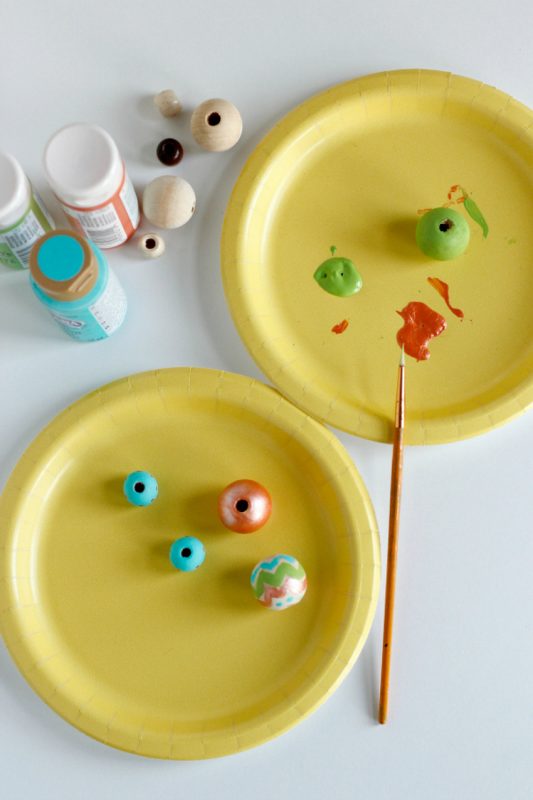
The width and height of the screenshot is (533, 800). Identify the location of red paint. (118, 210).